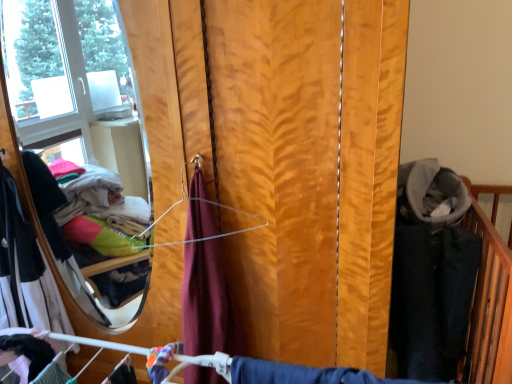
Question: From a real-world perspective, is matte black fabric at lower left, which ranks as the 1th clothing in right-to-left order, positioned above or below wooden blinds at center?

Choices:
 (A) above
 (B) below

Answer: (B)

Question: Considering the positions of matte black fabric at lower left, the second clothing in the left-to-right sequence, and wooden blinds at center in the image, is matte black fabric at lower left, the second clothing in the left-to-right sequence, taller or shorter than wooden blinds at center?

Choices:
 (A) tall
 (B) short

Answer: (B)

Question: Based on their relative distances, which object is farther from the wooden blinds at center?

Choices:
 (A) matte black fabric at lower left, marked as the 1th clothing in a front-to-back arrangement
 (B) white cotton dress at left, which ranks as the 1th clothing in left-to-right order

Answer: (B)

Question: Which is farther from the white cotton dress at left, which ranks as the 1th clothing in left-to-right order?

Choices:
 (A) wooden blinds at center
 (B) matte black fabric at lower left, the second clothing positioned from the back

Answer: (A)